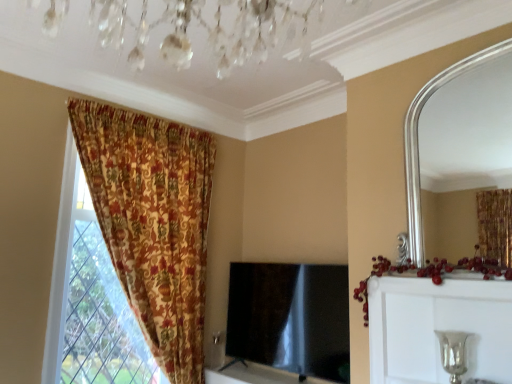
Question: Is silver metallic candle holder at lower right inside floral fabric curtain at left?

Choices:
 (A) yes
 (B) no

Answer: (B)

Question: Is the position of floral fabric curtain at left less distant than that of silver metallic candle holder at lower right?

Choices:
 (A) yes
 (B) no

Answer: (B)

Question: Considering the relative sizes of floral fabric curtain at left and silver metallic candle holder at lower right in the image provided, is floral fabric curtain at left shorter than silver metallic candle holder at lower right?

Choices:
 (A) no
 (B) yes

Answer: (A)

Question: Is floral fabric curtain at left turned away from silver metallic candle holder at lower right?

Choices:
 (A) no
 (B) yes

Answer: (A)

Question: Are floral fabric curtain at left and silver metallic candle holder at lower right beside each other?

Choices:
 (A) no
 (B) yes

Answer: (A)

Question: From a real-world perspective, is floral fabric curtain at left located beneath silver metallic candle holder at lower right?

Choices:
 (A) no
 (B) yes

Answer: (A)

Question: Is black glossy tv at center turned away from silver metallic vase at upper right?

Choices:
 (A) yes
 (B) no

Answer: (B)

Question: Considering the relative sizes of black glossy tv at center and silver metallic vase at upper right in the image provided, is black glossy tv at center shorter than silver metallic vase at upper right?

Choices:
 (A) yes
 (B) no

Answer: (B)

Question: From a real-world perspective, is black glossy tv at center beneath silver metallic vase at upper right?

Choices:
 (A) yes
 (B) no

Answer: (A)

Question: Is black glossy tv at center surrounding silver metallic vase at upper right?

Choices:
 (A) yes
 (B) no

Answer: (B)

Question: From a real-world perspective, is black glossy tv at center on silver metallic vase at upper right?

Choices:
 (A) no
 (B) yes

Answer: (A)

Question: From the image's perspective, would you say black glossy tv at center is shown under silver metallic vase at upper right?

Choices:
 (A) no
 (B) yes

Answer: (B)

Question: Considering the relative sizes of black glossy tv at center and silver metallic candle holder at lower right in the image provided, is black glossy tv at center shorter than silver metallic candle holder at lower right?

Choices:
 (A) yes
 (B) no

Answer: (B)